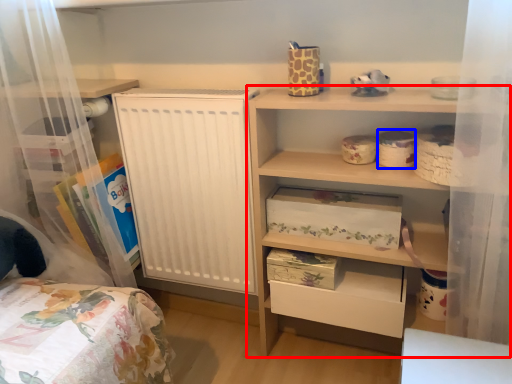
Question: Which object appears farthest to the camera in this image, shelf (highlighted by a red box) or storage box (highlighted by a blue box)?

Choices:
 (A) shelf
 (B) storage box

Answer: (B)